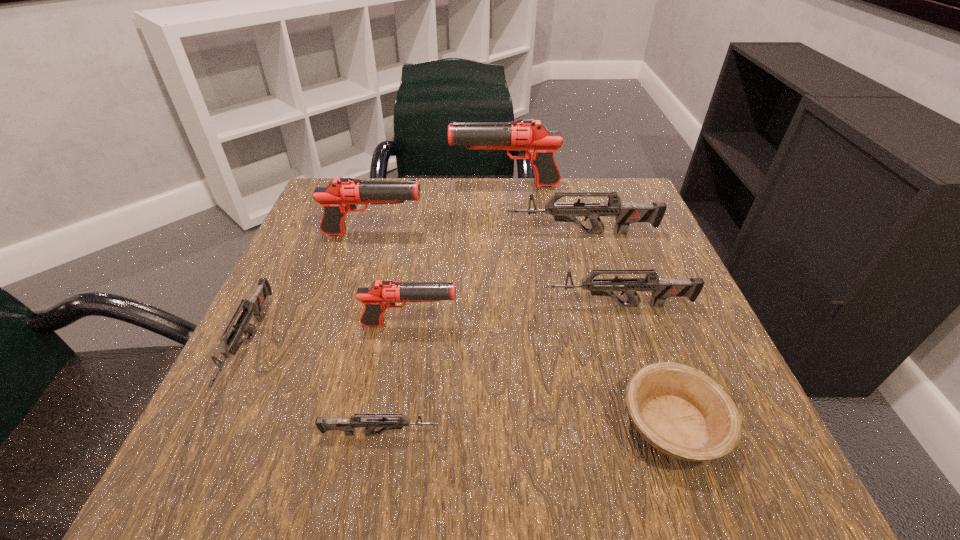
Locate which gun is the fourth closest to the shortest gun. Please provide its 2D coordinates. Your answer should be formatted as a tuple, i.e. [(x, y)], where the tuple contains the x and y coordinates of a point satisfying the conditions above.

[(341, 195)]

Identify the location of the fourth closest gun to the smallest black gun. This screenshot has width=960, height=540. (341, 195).

You are a GUI agent. You are given a task and a screenshot of the screen. Output one action in this format:
    pyautogui.click(x=<x>, y=<y>)
    Task: Click on the black gun that is the closest one to the farthest object
    
    Given the screenshot: What is the action you would take?
    pyautogui.click(x=341, y=195)

Identify which black gun is the second closest to the biggest grey gun. Please provide its 2D coordinates. Your answer should be formatted as a tuple, i.e. [(x, y)], where the tuple contains the x and y coordinates of a point satisfying the conditions above.

[(341, 195)]

In order to click on grey gun that stands as the second closest to the beige bowl in this screenshot , I will do `click(348, 425)`.

Select which grey gun is the second closest to the biggest grey gun. Please provide its 2D coordinates. Your answer should be formatted as a tuple, i.e. [(x, y)], where the tuple contains the x and y coordinates of a point satisfying the conditions above.

[(348, 425)]

Where is `vacant area that satisfies the following two spatial constraints: 1. on the back side of the beige bowl; 2. at the aiming end of the second smallest black gun`? vacant area that satisfies the following two spatial constraints: 1. on the back side of the beige bowl; 2. at the aiming end of the second smallest black gun is located at coordinates (605, 234).

Identify the location of free space that satisfies the following two spatial constraints: 1. at the aiming end of the seventh shortest object; 2. aimed along the barrel of the leftmost gun. (340, 343).

This screenshot has width=960, height=540. I want to click on vacant space that satisfies the following two spatial constraints: 1. on the front side of the beige bowl; 2. aimed along the barrel of the shortest gun, so click(x=676, y=434).

You are a GUI agent. You are given a task and a screenshot of the screen. Output one action in this format:
    pyautogui.click(x=<x>, y=<y>)
    Task: Click on the free region that satisfies the following two spatial constraints: 1. at the aiming end of the nearest black gun; 2. on the back side of the bowl
    
    Given the screenshot: What is the action you would take?
    pyautogui.click(x=394, y=425)